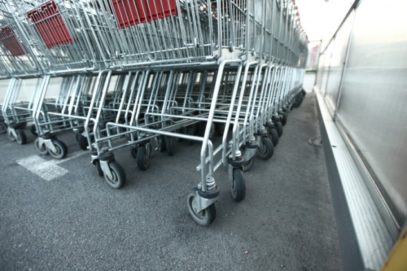
The width and height of the screenshot is (407, 271). What are the coordinates of `1st red child seat bottom` in the screenshot? It's located at (131, 10).